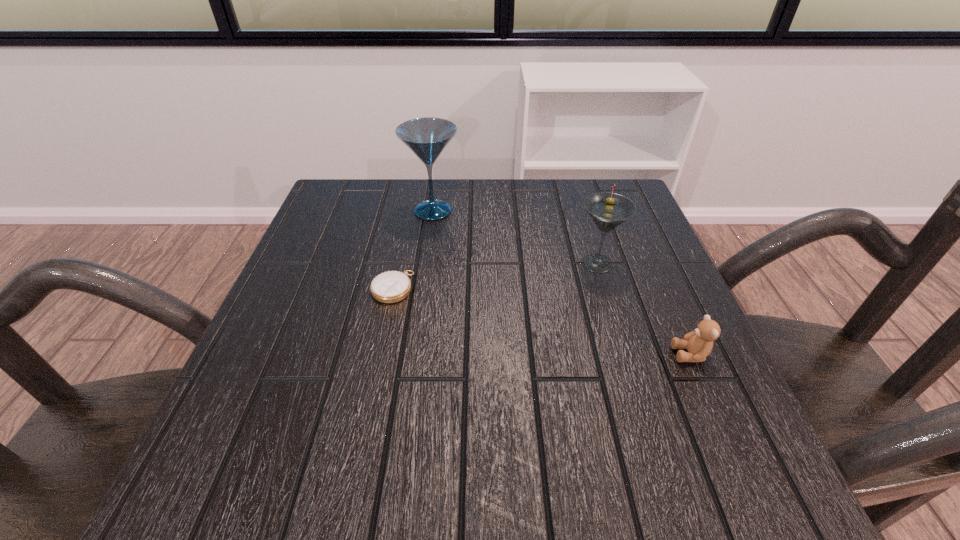
This screenshot has height=540, width=960. I want to click on the taller martini, so click(427, 137).

Find the location of a particular element. This screenshot has height=540, width=960. the farthest object is located at coordinates (427, 137).

Find the location of a particular element. the shorter martini is located at coordinates (608, 210).

You are a GUI agent. You are given a task and a screenshot of the screen. Output one action in this format:
    pyautogui.click(x=<x>, y=<y>)
    Task: Click on the third object from left to right
    This screenshot has height=540, width=960.
    Given the screenshot: What is the action you would take?
    click(608, 210)

You are a GUI agent. You are given a task and a screenshot of the screen. Output one action in this format:
    pyautogui.click(x=<x>, y=<y>)
    Task: Click on the rightmost object
    The image size is (960, 540).
    Given the screenshot: What is the action you would take?
    pyautogui.click(x=699, y=343)

Locate an element on the screen. This screenshot has width=960, height=540. teddy bear is located at coordinates (699, 343).

Image resolution: width=960 pixels, height=540 pixels. In order to click on the shortest object in this screenshot , I will do `click(393, 286)`.

Where is `blank space located on the right of the tallest object`? Image resolution: width=960 pixels, height=540 pixels. blank space located on the right of the tallest object is located at coordinates (496, 211).

The image size is (960, 540). I want to click on vacant space located on the left of the right martini, so click(x=420, y=263).

I want to click on blank area located on the front-facing side of the nearest object, so click(442, 354).